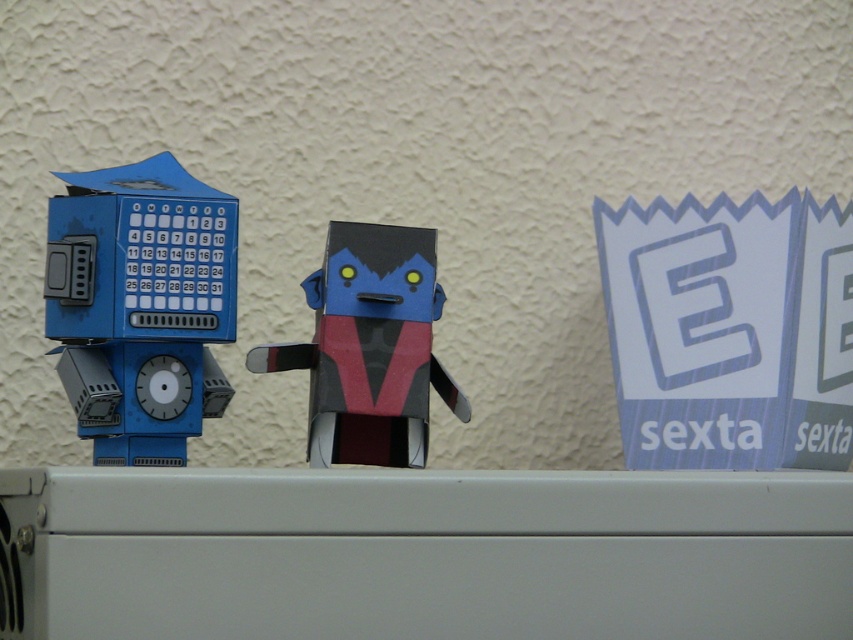
Is matte blue robot at left positioned in front of matte black and red cardboard toy at center?

Yes, matte blue robot at left is in front of matte black and red cardboard toy at center.

Does matte blue robot at left have a lesser width compared to matte black and red cardboard toy at center?

Yes.

Which is in front, point (103, 442) or point (346, 442)?

Point (103, 442) is more forward.

Where is `matte blue robot at left`? matte blue robot at left is located at coordinates (140, 305).